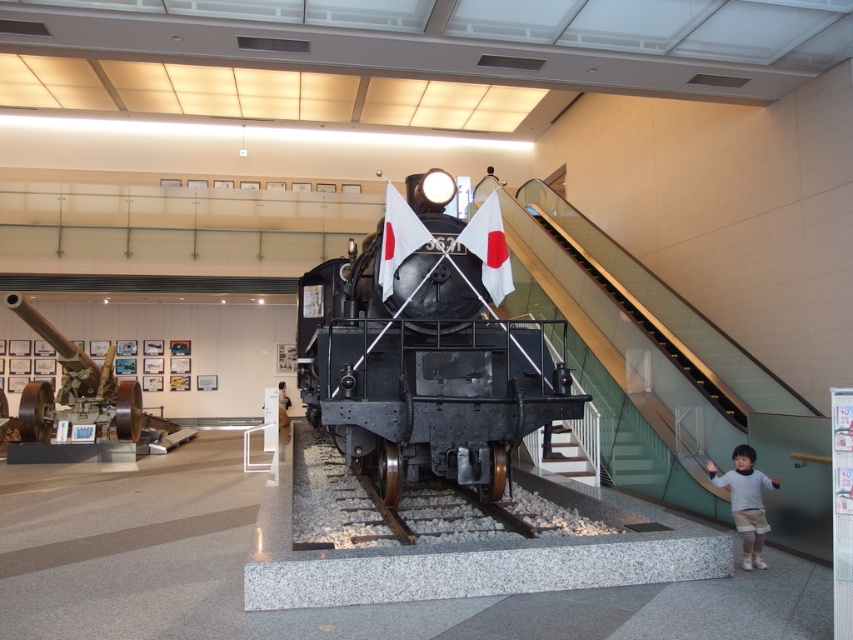
Which is above, polished black locomotive at center or gray metallic train track at center?

polished black locomotive at center

Who is lower down, polished black locomotive at center or gray metallic train track at center?

gray metallic train track at center is lower down.

You are a GUI agent. You are given a task and a screenshot of the screen. Output one action in this format:
    pyautogui.click(x=<x>, y=<y>)
    Task: Click on the polished black locomotive at center
    The width and height of the screenshot is (853, 640).
    Given the screenshot: What is the action you would take?
    pyautogui.click(x=422, y=360)

At what (x,y) coordinates should I click in order to perform the action: click on polished black locomotive at center. Please return your answer as a coordinate pair (x, y). Looking at the image, I should click on (422, 360).

Between polished black locomotive at center and shiny black cannon at left, which one is positioned lower?

shiny black cannon at left

Locate an element on the screen. Image resolution: width=853 pixels, height=640 pixels. polished black locomotive at center is located at coordinates tap(422, 360).

Find the location of a particular element. The width and height of the screenshot is (853, 640). polished black locomotive at center is located at coordinates (422, 360).

Can you confirm if polished black locomotive at center is smaller than clear glass stairs at center?

Yes.

Can you confirm if polished black locomotive at center is positioned to the left of clear glass stairs at center?

Indeed, polished black locomotive at center is positioned on the left side of clear glass stairs at center.

Who is more distant from viewer, (332,276) or (611,276)?

The point (611,276) is behind.

This screenshot has height=640, width=853. Find the location of `polished black locomotive at center`. polished black locomotive at center is located at coordinates (422, 360).